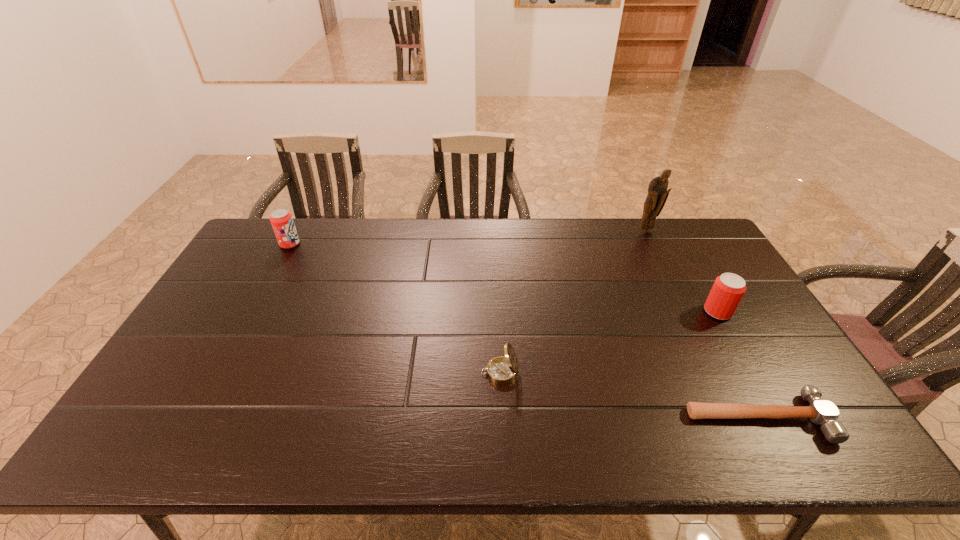
You are a GUI agent. You are given a task and a screenshot of the screen. Output one action in this format:
    pyautogui.click(x=<x>, y=<y>)
    Task: Click on the closest object to the hammer
    
    Given the screenshot: What is the action you would take?
    pyautogui.click(x=728, y=289)

Where is `free location that satisfies the following two spatial constraints: 1. on the surface of the fourth nearest object; 2. on the right side of the nearest object`? This screenshot has height=540, width=960. free location that satisfies the following two spatial constraints: 1. on the surface of the fourth nearest object; 2. on the right side of the nearest object is located at coordinates (196, 417).

Where is `free space that satisfies the following two spatial constraints: 1. on the front-facing side of the tallest object; 2. on the right side of the beer can`? This screenshot has height=540, width=960. free space that satisfies the following two spatial constraints: 1. on the front-facing side of the tallest object; 2. on the right side of the beer can is located at coordinates (685, 312).

I want to click on free region that satisfies the following two spatial constraints: 1. on the front-facing side of the farthest object; 2. on the surface of the fourth nearest object, so click(653, 244).

This screenshot has height=540, width=960. In order to click on free space that satisfies the following two spatial constraints: 1. with the dial facing the fourth object from right to left; 2. on the left side of the shortest object in this screenshot , I will do `click(502, 417)`.

Image resolution: width=960 pixels, height=540 pixels. In order to click on free space that satisfies the following two spatial constraints: 1. on the front-facing side of the figurine; 2. on the surface of the soda can in this screenshot , I will do `click(653, 244)`.